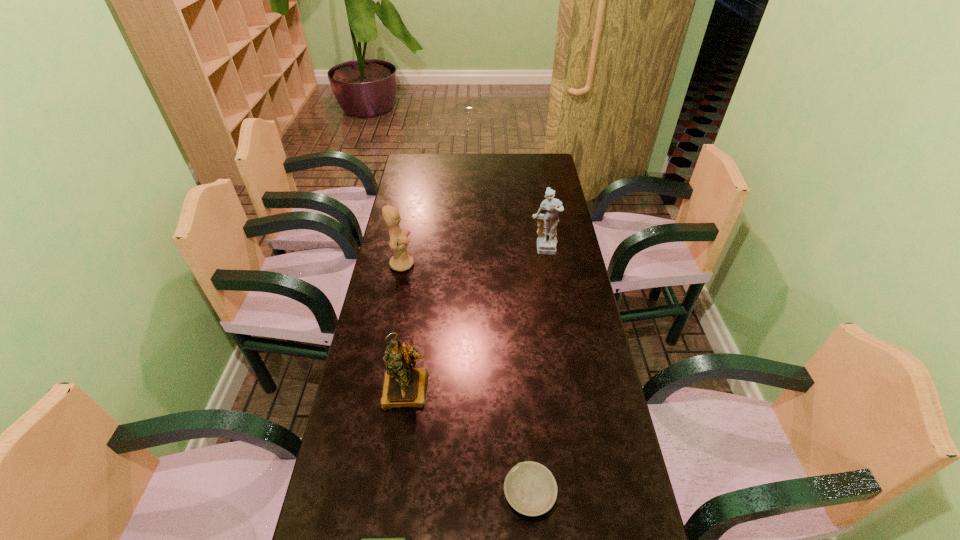
Identify the location of the rightmost figurine. (547, 223).

Find the location of a particular element. The image size is (960, 540). the nearest figurine is located at coordinates (403, 386).

The width and height of the screenshot is (960, 540). In order to click on bowl in this screenshot , I will do `click(530, 488)`.

You are a GUI agent. You are given a task and a screenshot of the screen. Output one action in this format:
    pyautogui.click(x=<x>, y=<y>)
    Task: Click on the fourth tallest object
    The image size is (960, 540).
    Given the screenshot: What is the action you would take?
    pyautogui.click(x=530, y=488)

At what (x,y) coordinates should I click in order to perform the action: click on vacant region located 0.260m on the front-facing side of the rightmost figurine. Please return your answer as a coordinate pair (x, y). The image size is (960, 540). Looking at the image, I should click on (553, 313).

Locate an element on the screen. vacant position located 0.220m on the front-facing side of the third farthest object is located at coordinates (393, 495).

At what (x,y) coordinates should I click in order to perform the action: click on free space located 0.100m on the left of the second shortest object. Please return your answer as a coordinate pair (x, y). Looking at the image, I should click on (461, 494).

Where is `object that is at the right edge`? Image resolution: width=960 pixels, height=540 pixels. object that is at the right edge is located at coordinates (547, 223).

Find the location of `vacant space at the far edge of the desktop`. vacant space at the far edge of the desktop is located at coordinates (483, 159).

The height and width of the screenshot is (540, 960). In the image, there is a desktop. Identify the location of vacant space at the left edge. (381, 312).